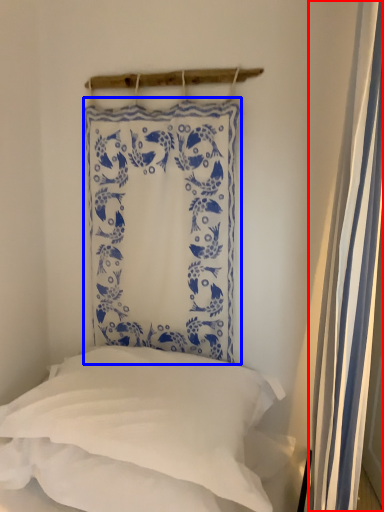
Question: Among these objects, which one is farthest to the camera, shower curtain (highlighted by a red box) or curtain (highlighted by a blue box)?

Choices:
 (A) shower curtain
 (B) curtain

Answer: (B)